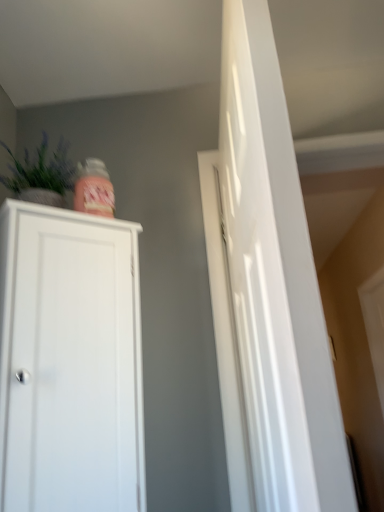
Question: Should I look upward or downward to see white matte cabinet at left?

Choices:
 (A) down
 (B) up

Answer: (A)

Question: Considering the relative sizes of white matte cabinet at left and glossy white door at right in the image provided, is white matte cabinet at left wider than glossy white door at right?

Choices:
 (A) no
 (B) yes

Answer: (B)

Question: Is white matte cabinet at left positioned with its back to glossy white door at right?

Choices:
 (A) no
 (B) yes

Answer: (A)

Question: From the image's perspective, is white matte cabinet at left on top of glossy white door at right?

Choices:
 (A) no
 (B) yes

Answer: (A)

Question: Would you say glossy white door at right is part of white matte cabinet at left's contents?

Choices:
 (A) yes
 (B) no

Answer: (B)

Question: Is white matte cabinet at left oriented towards glossy white door at right?

Choices:
 (A) yes
 (B) no

Answer: (A)

Question: Can you confirm if white matte cabinet at left is positioned to the right of glossy white door at right?

Choices:
 (A) yes
 (B) no

Answer: (B)

Question: Is glossy white door at right completely or partially outside of white matte cabinet at left?

Choices:
 (A) no
 (B) yes

Answer: (B)

Question: Does glossy white door at right have a greater height compared to white matte cabinet at left?

Choices:
 (A) no
 (B) yes

Answer: (B)

Question: Is glossy white door at right positioned with its back to white matte cabinet at left?

Choices:
 (A) yes
 (B) no

Answer: (A)

Question: Considering the relative sizes of glossy white door at right and white matte cabinet at left in the image provided, is glossy white door at right shorter than white matte cabinet at left?

Choices:
 (A) no
 (B) yes

Answer: (A)

Question: Can you confirm if glossy white door at right is bigger than white matte cabinet at left?

Choices:
 (A) yes
 (B) no

Answer: (A)

Question: Is glossy white door at right to the right of white matte cabinet at left from the viewer's perspective?

Choices:
 (A) yes
 (B) no

Answer: (A)

Question: Is green matte vase at upper left with glossy white door at right?

Choices:
 (A) yes
 (B) no

Answer: (B)